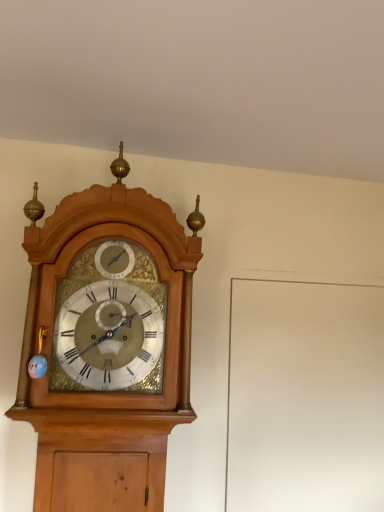
This screenshot has width=384, height=512. Describe the element at coordinates (107, 345) in the screenshot. I see `wooden grandfather clock at left` at that location.

You are a GUI agent. You are given a task and a screenshot of the screen. Output one action in this format:
    pyautogui.click(x=<x>, y=<y>)
    Task: Click on the wooden grandfather clock at left
    This screenshot has height=512, width=384.
    Given the screenshot: What is the action you would take?
    pyautogui.click(x=107, y=345)

Find the location of `wooden grandfather clock at left`. wooden grandfather clock at left is located at coordinates (107, 345).